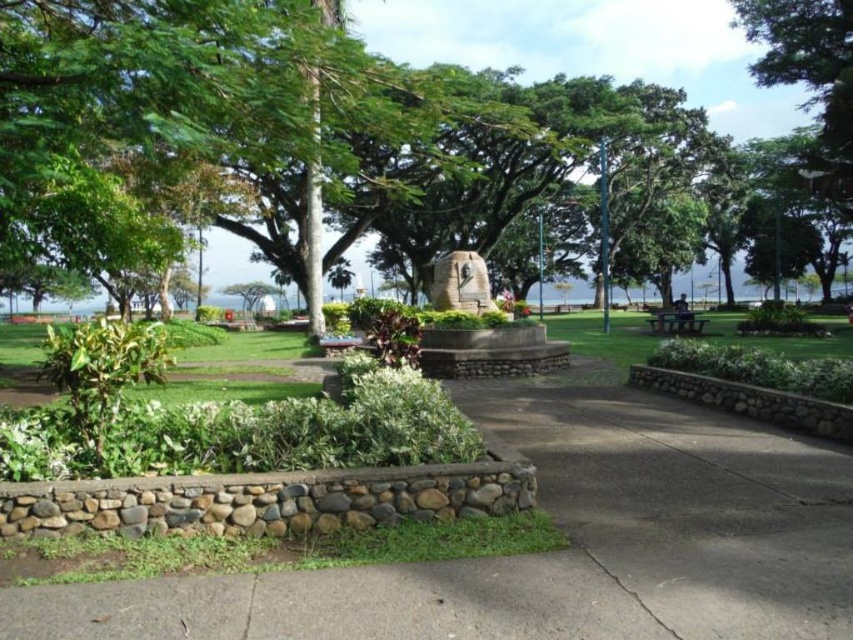
Question: Which point is closer to the camera?

Choices:
 (A) rustic stone monument at center
 (B) green leafy tree at center
 (C) green stone bench at center
 (D) wooden park bench at center

Answer: (C)

Question: Is the position of green stone bench at center more distant than that of wooden park bench at center?

Choices:
 (A) no
 (B) yes

Answer: (A)

Question: Which point is closer to the camera taking this photo?

Choices:
 (A) (498, 582)
 (B) (776, 122)

Answer: (A)

Question: Which point appears closest to the camera in this image?

Choices:
 (A) (453, 257)
 (B) (782, 454)
 (C) (422, 12)

Answer: (B)

Question: Is green stone bench at center above wooden park bench at center?

Choices:
 (A) no
 (B) yes

Answer: (A)

Question: Is green stone bench at center to the left of rustic stone monument at center from the viewer's perspective?

Choices:
 (A) no
 (B) yes

Answer: (A)